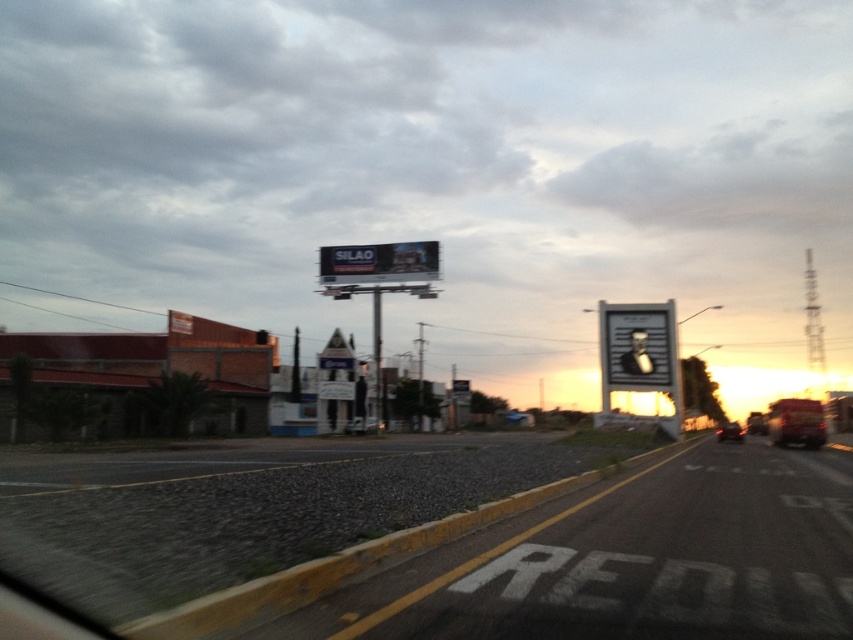
You are driving a car and see the brown brick building at left and the metallic silver portrait at right. Which object is closer to you?

The brown brick building at left is closer to you because it is in front of the metallic silver portrait at right.

You are driving on a road and see a matte black portrait at center and a metallic silver billboard at center. Which object is positioned to the right side from your perspective?

→ The matte black portrait at center is to the right of the metallic silver billboard at center.